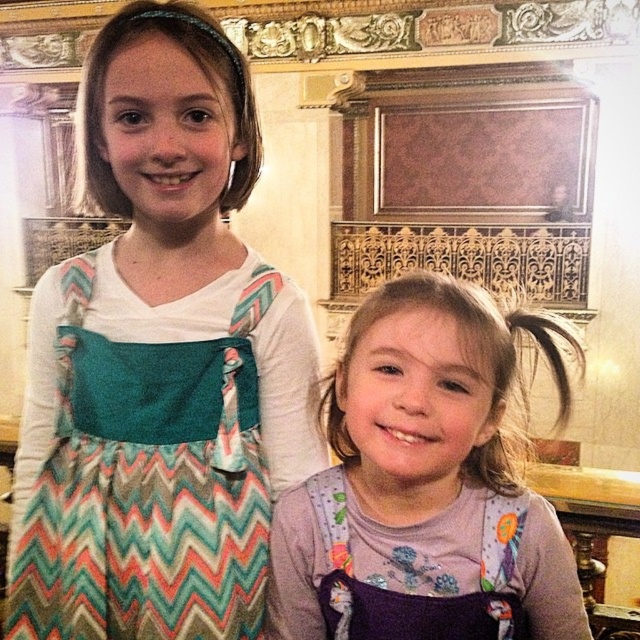
You are standing in a room with two girls. You need to take a photo of the point at coordinate point (518, 595). The camera you are using has a maximum focus range of 4 feet. Will the point be in focus?

The distance of point (518, 595) from the camera is 3.82 feet, which is within the camera maximum focus range of 4 feet. So the point will be in focus.

You are taking a photo of two girls in an ornate room. You notice two points marked in the image. The first point is at coordinate point (468, 612) and the second is at point (259, 625). Which point is nearer to the camera?

Point (468, 612) is closer to the camera than point (259, 625).